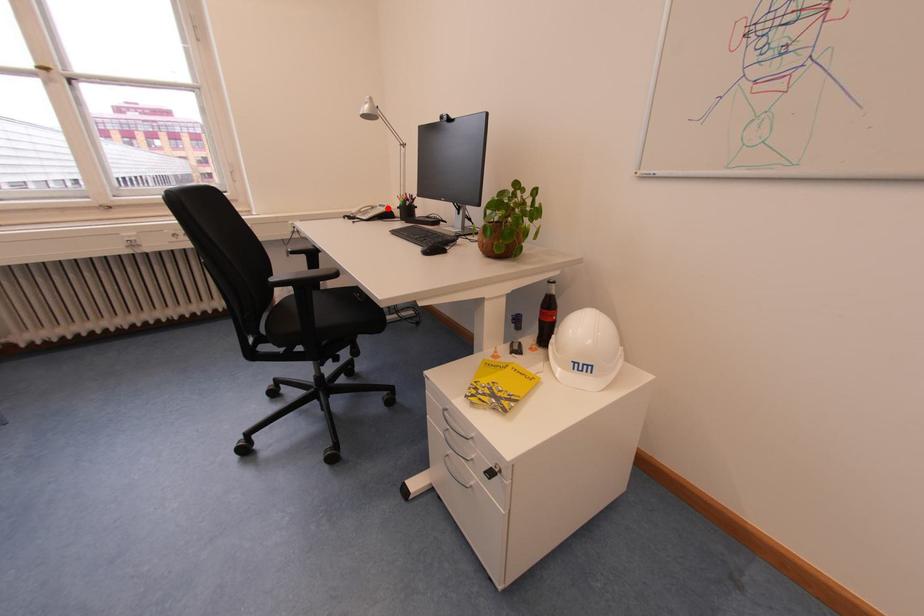
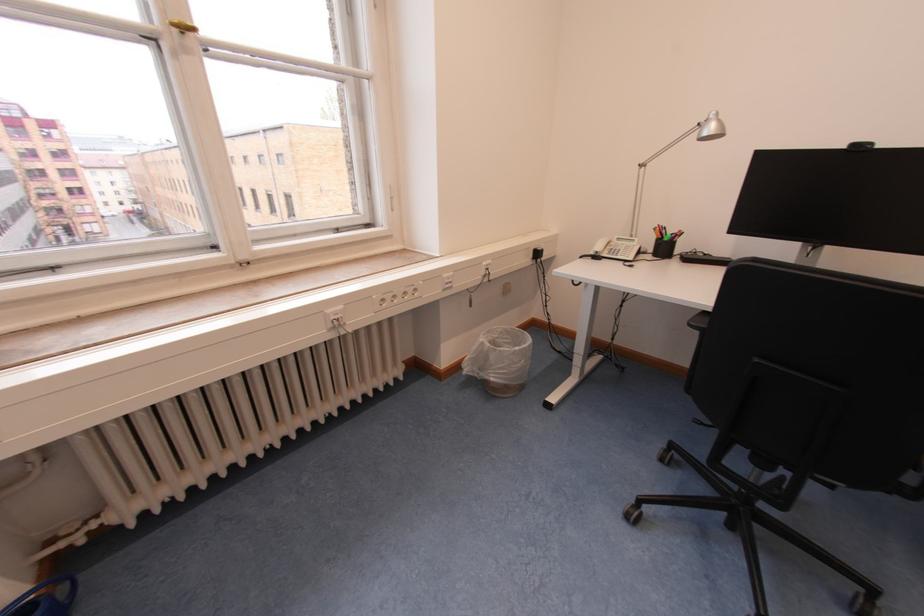
The point at the highlighted location is marked in the first image. Where is the corresponding point in the second image?

(625, 241)